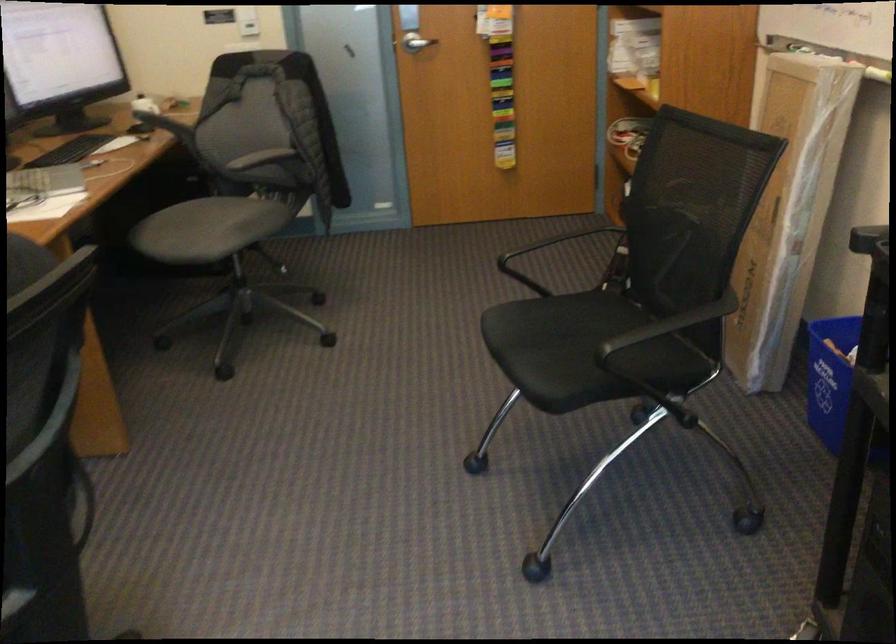
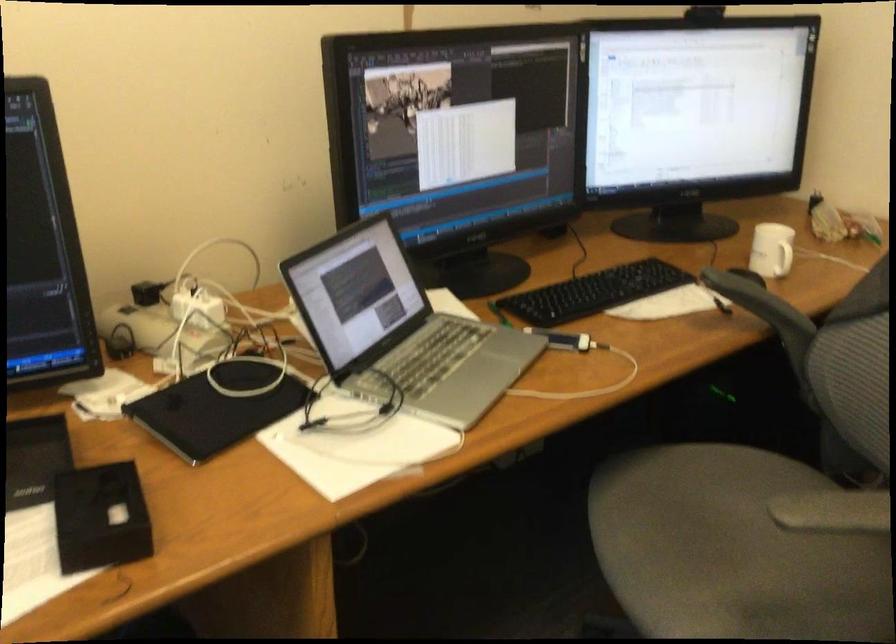
In the second image, find the point that corresponds to (x=156, y=107) in the first image.

(782, 259)